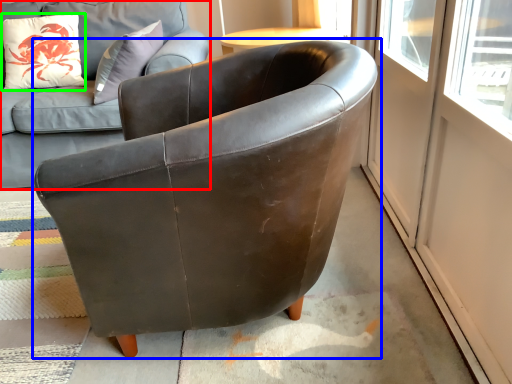
Question: Based on their relative distances, which object is nearer to studio couch (highlighted by a red box)? Choose from chair (highlighted by a blue box) and pillow (highlighted by a green box).

Choices:
 (A) chair
 (B) pillow

Answer: (B)